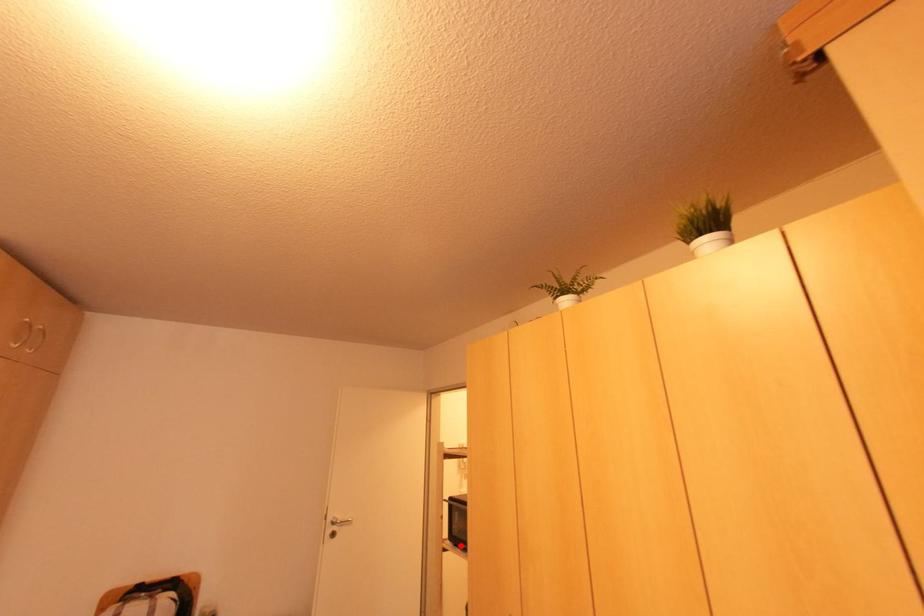
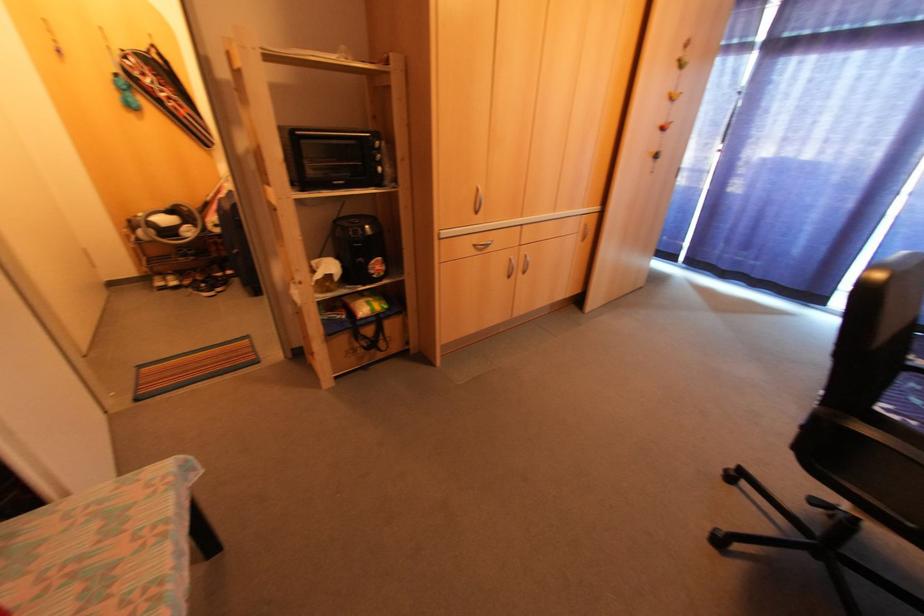
Question: A red point is marked in image1. In image2, is the corresponding 3D point closer to the camera or farther? Reply with the corresponding letter.

Choices:
 (A) The corresponding 3D point is closer.
 (B) The corresponding 3D point is farther.

Answer: (A)